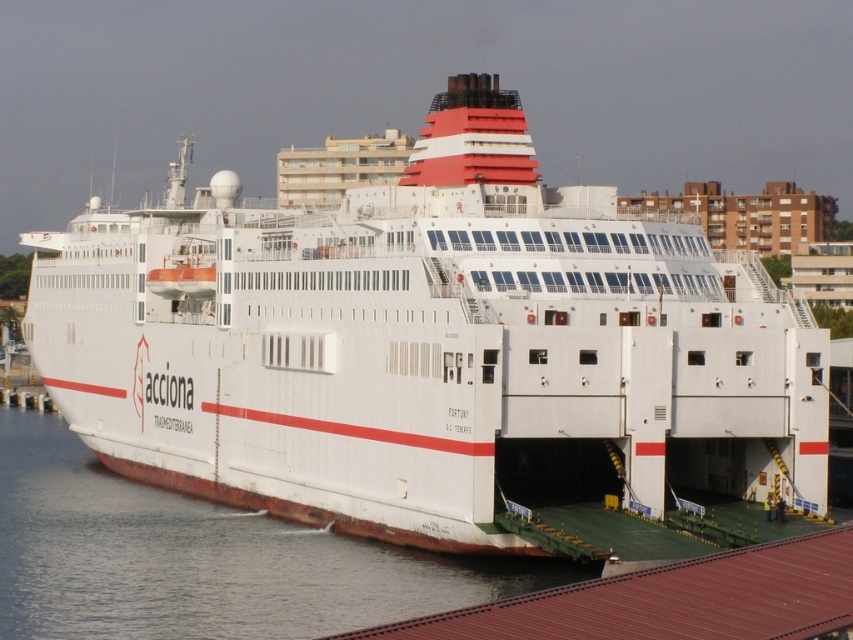
Question: Which point is farther to the camera?

Choices:
 (A) (606, 634)
 (B) (734, 426)

Answer: (B)

Question: Is white matte ship at center positioned in front of white water at lower left?

Choices:
 (A) no
 (B) yes

Answer: (A)

Question: Is white water at lower left to the right of brown corrugated metal dock at lower right from the viewer's perspective?

Choices:
 (A) yes
 (B) no

Answer: (B)

Question: Considering the real-world distances, which object is farthest from the brown corrugated metal dock at lower right?

Choices:
 (A) white matte ship at center
 (B) white water at lower left

Answer: (A)

Question: Which object is positioned farthest from the white water at lower left?

Choices:
 (A) brown corrugated metal dock at lower right
 (B) white matte ship at center

Answer: (A)

Question: Does white matte ship at center appear under white water at lower left?

Choices:
 (A) no
 (B) yes

Answer: (A)